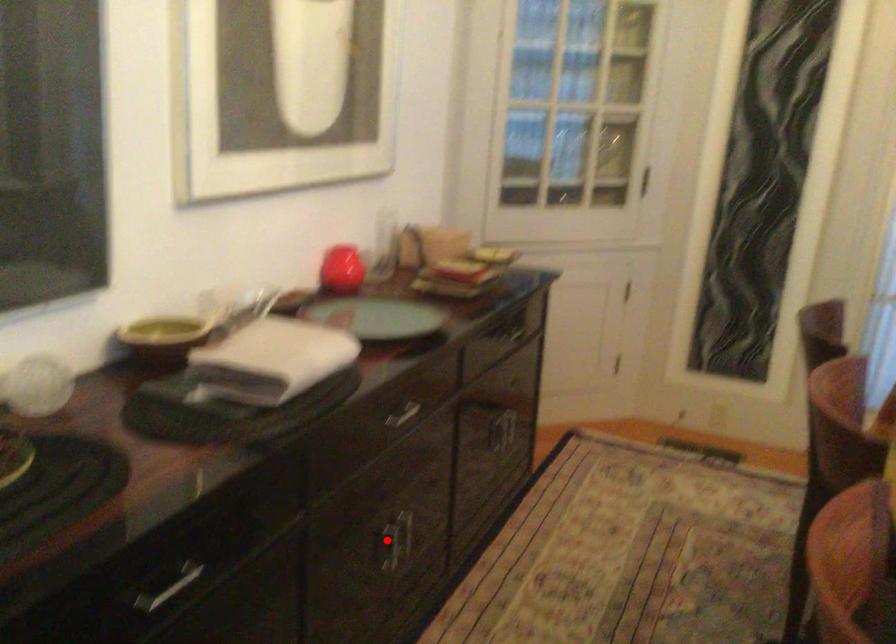
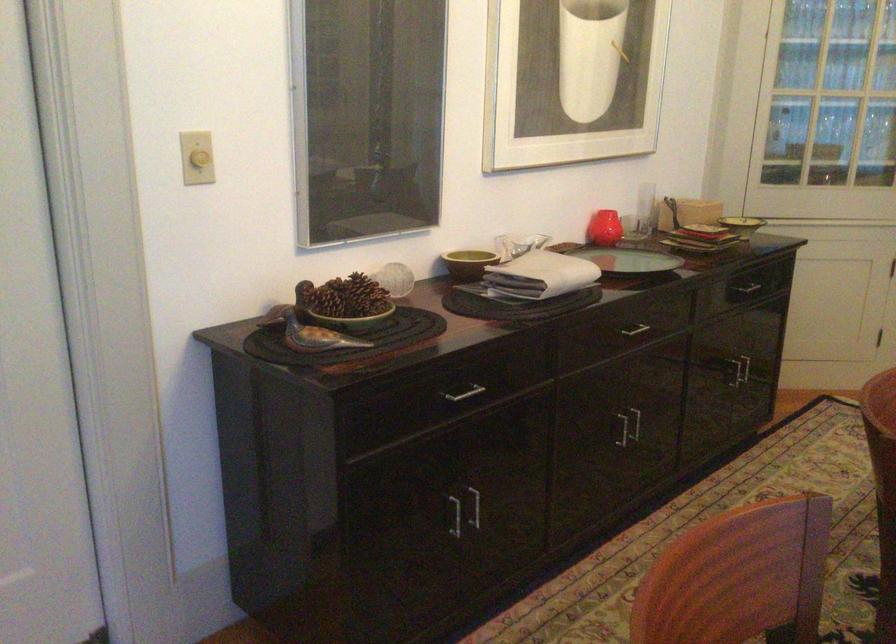
Question: I am providing you with two images of the same scene from different viewpoints. A red point is marked on the first image. Can you still see the location of the red point in image 2?

Choices:
 (A) Yes
 (B) No

Answer: (A)